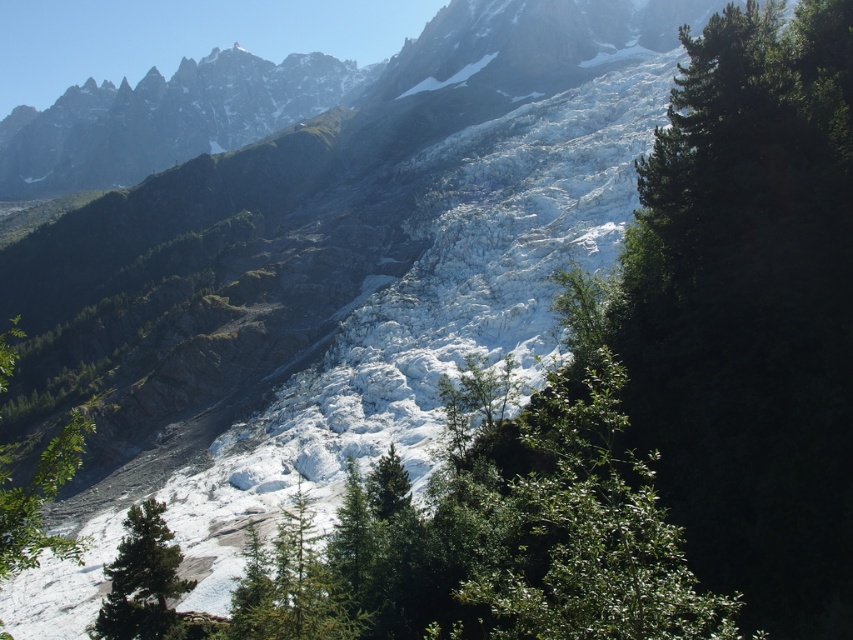
Based on the photo, in the mountainous landscape with the glacier, there is a green matte tree at lower left and a point marked at coordinates (142, 580). Is the green matte tree at lower left positioned exactly at that point?

The green matte tree at lower left is located at point (142, 580), so yes, it is positioned exactly at that point.

You are a hiker standing at the center of the image. You want to take a photo of the green matte tree at lower left. In which direction should you point your camera?

You should point your camera to the lower left direction to capture the green matte tree at lower left, as it is located at point coordinates of (142, 580).

You are standing at the base of the glacier and want to reach the highest point on the mountain. You notice two points marked on your map as point 1 at coordinates point (143, 604) and point 2 at coordinates point (9, 518). Which point should you aim for if you want to reach the highest elevation?

Point (143, 604) is further to the camera than point (9, 518), so it is closer to you. Since you are at the base, aiming for the closer point might be easier, but elevation depends on the mountain slope. However, based on the given information, point (143, 604) is nearer, so you should aim for it first to reach higher ground quickly.